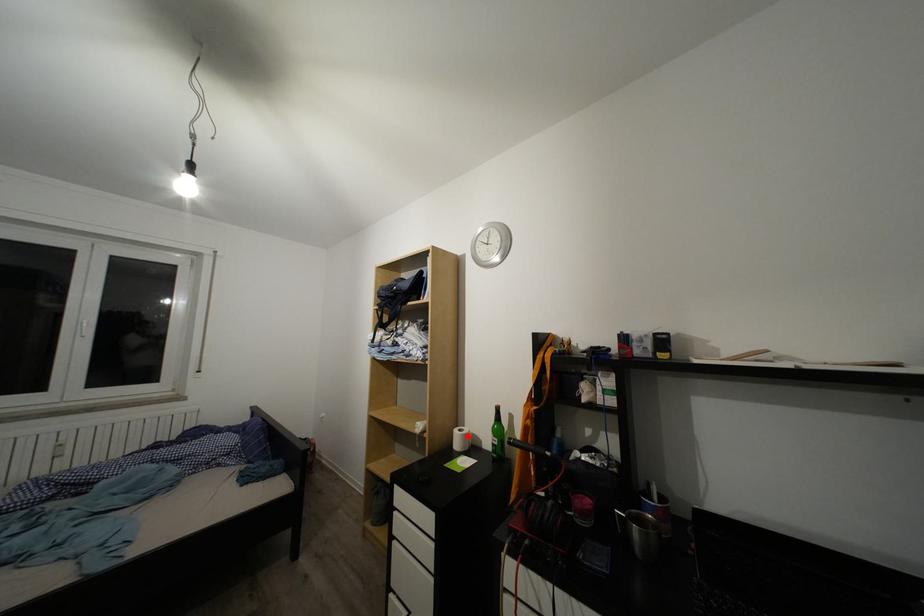
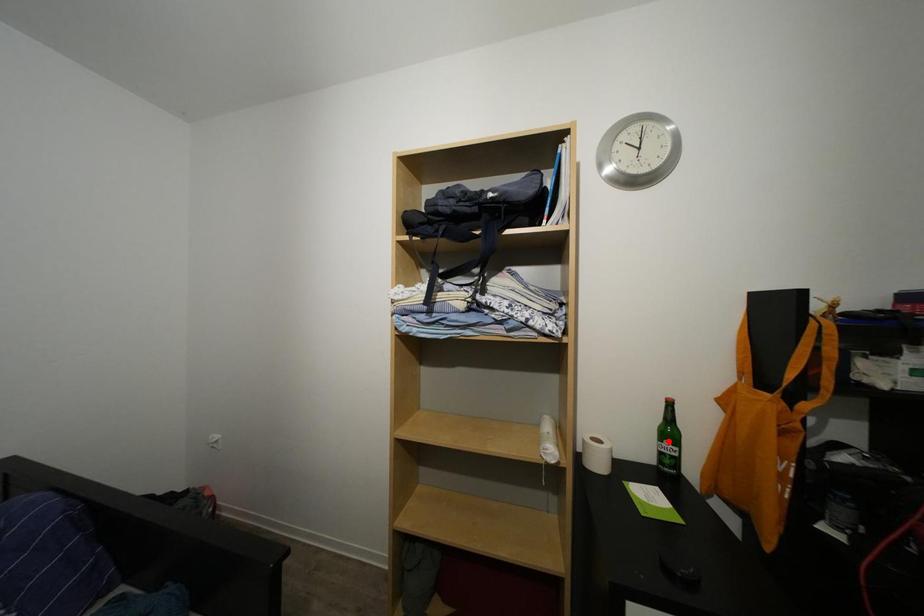
I am providing you with two images of the same scene from different viewpoints. A red point is marked on the first image and another point is marked on the second image. Do the highlighted points in image1 and image2 indicate the same real-world spot?

No